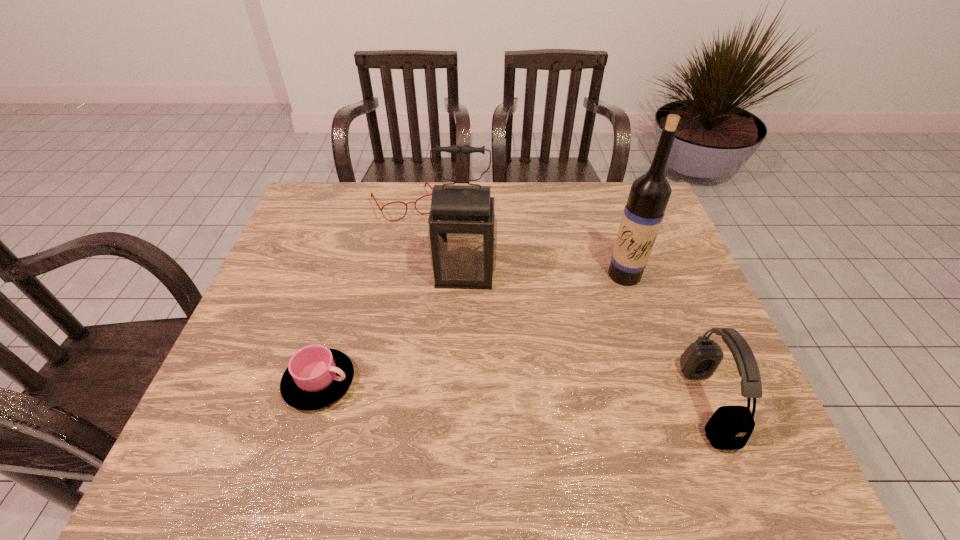
You are a GUI agent. You are given a task and a screenshot of the screen. Output one action in this format:
    pyautogui.click(x=<x>, y=<y>)
    Task: Click on the cup
    The width and height of the screenshot is (960, 540).
    Given the screenshot: What is the action you would take?
    pyautogui.click(x=316, y=377)

This screenshot has height=540, width=960. Identify the location of the rightmost object. (730, 427).

At what (x,y) coordinates should I click in order to perform the action: click on the third shortest object. Please return your answer as a coordinate pair (x, y). This screenshot has height=540, width=960. Looking at the image, I should click on (730, 427).

Identify the location of the fourth object from left to right. The width and height of the screenshot is (960, 540). (649, 194).

You are a GUI agent. You are given a task and a screenshot of the screen. Output one action in this format:
    pyautogui.click(x=<x>, y=<y>)
    Task: Click on the fourth shortest object
    This screenshot has height=540, width=960.
    Given the screenshot: What is the action you would take?
    pyautogui.click(x=462, y=234)

You are a GUI agent. You are given a task and a screenshot of the screen. Output one action in this format:
    pyautogui.click(x=<x>, y=<y>)
    Task: Click on the farthest object
    
    Given the screenshot: What is the action you would take?
    pyautogui.click(x=381, y=209)

In order to click on vacant space located 0.370m on the side with the handle of the cup in this screenshot , I will do `click(520, 382)`.

Find the location of a particular element. This screenshot has width=960, height=540. blank space located 0.390m on the headband of the headset is located at coordinates (511, 403).

Identify the location of vacant space situated 0.280m on the headband of the headset. The height and width of the screenshot is (540, 960). (562, 403).

Identify the location of vacant region located 0.060m on the headband of the headset. (663, 403).